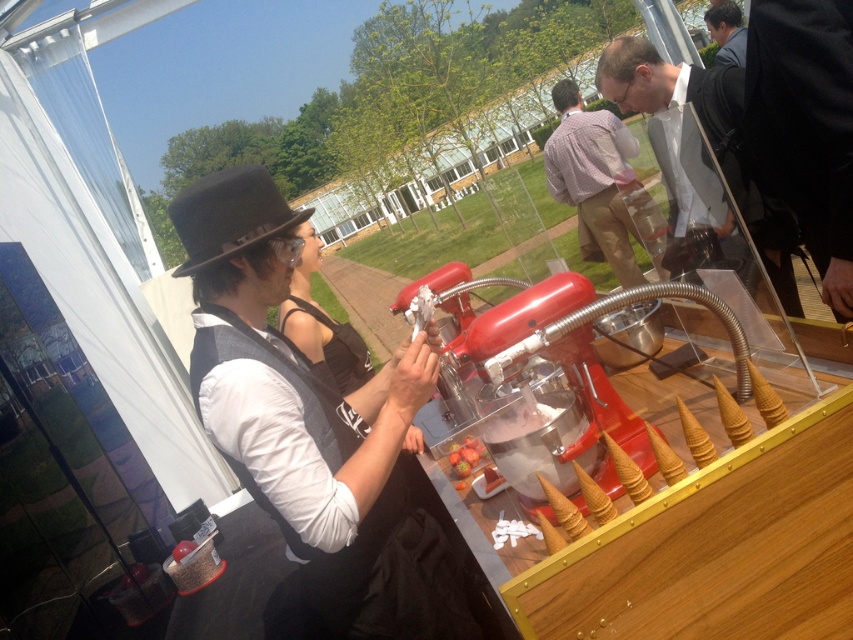
Is black satin dress at center positioned at the back of smooth strawberry at center?

No, black satin dress at center is closer to the viewer.

Can you confirm if black satin dress at center is positioned above smooth strawberry at center?

Indeed, black satin dress at center is positioned over smooth strawberry at center.

Find the location of `black satin dress at center`. black satin dress at center is located at coordinates (321, 324).

Between smooth black suit at upper right and smooth strawberry at center, which one is positioned lower?

smooth strawberry at center is below.

Between smooth black suit at upper right and smooth strawberry at center, which one has less height?

smooth strawberry at center is shorter.

Measure the distance between smooth black suit at upper right and camera.

The distance of smooth black suit at upper right from camera is 12.98 feet.

The width and height of the screenshot is (853, 640). Identify the location of smooth black suit at upper right. (726, 33).

Between plaid shirt at center and smooth strawberry at center, which one is positioned lower?

smooth strawberry at center is below.

Can you confirm if plaid shirt at center is thinner than smooth strawberry at center?

In fact, plaid shirt at center might be wider than smooth strawberry at center.

Describe the element at coordinates (601, 182) in the screenshot. This screenshot has width=853, height=640. I see `plaid shirt at center` at that location.

Locate an element on the screen. This screenshot has height=640, width=853. plaid shirt at center is located at coordinates (601, 182).